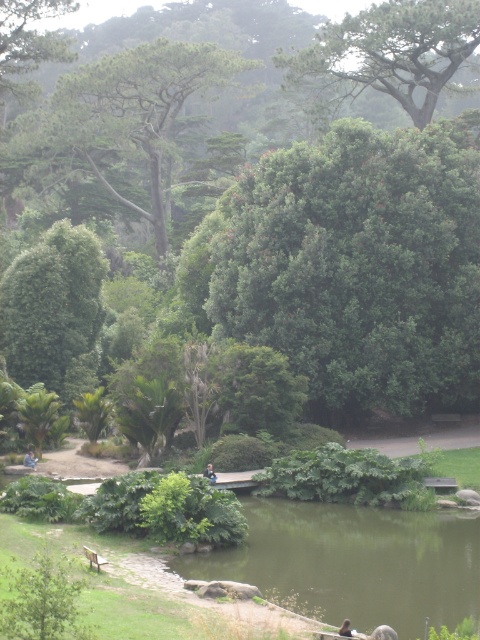
Question: Which point is closer to the camera taking this photo?

Choices:
 (A) (110, 161)
 (B) (358, 42)
 (C) (213, 474)

Answer: (C)

Question: Estimate the real-world distances between objects in this image. Which object is farther from the green leafy tree at center?

Choices:
 (A) green textured tree at upper left
 (B) dark blue fabric jacket at center
 (C) blue denim jacket at center

Answer: (A)

Question: Does green leafy tree at center appear on the left side of green textured tree at upper left?

Choices:
 (A) no
 (B) yes

Answer: (A)

Question: Which object is closer to the camera taking this photo?

Choices:
 (A) green leafy tree at upper center
 (B) green leafy tree at center

Answer: (B)

Question: Can you confirm if green leafy tree at center is positioned to the right of green textured tree at upper left?

Choices:
 (A) no
 (B) yes

Answer: (B)

Question: Can you confirm if blue denim jacket at center is thinner than dark blue fabric jacket at center?

Choices:
 (A) yes
 (B) no

Answer: (B)